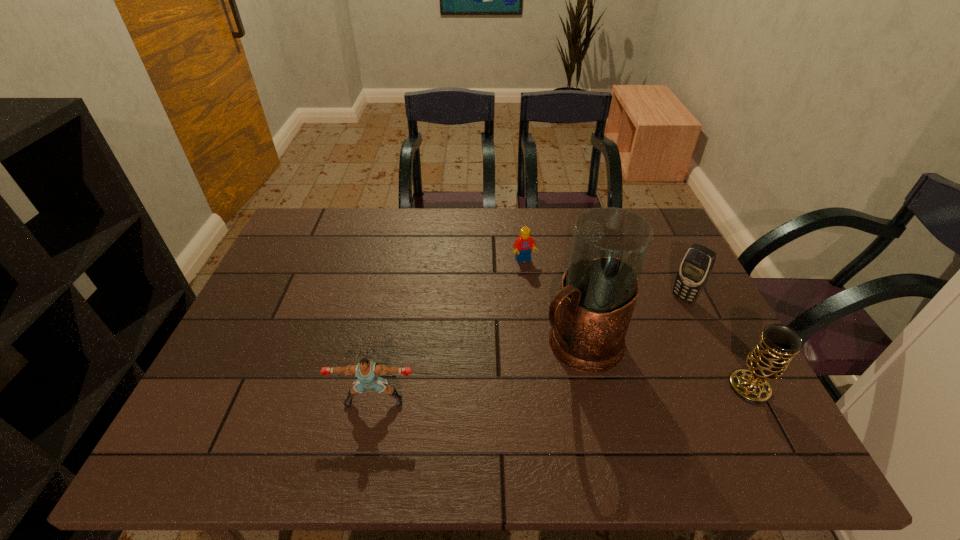
Identify the location of free space between the cellular telephone and the chalice. (716, 343).

The height and width of the screenshot is (540, 960). Find the location of `blank region between the pitcher and the cellular telephone`. blank region between the pitcher and the cellular telephone is located at coordinates (632, 321).

This screenshot has width=960, height=540. In order to click on vacant space that is in between the tallest object and the second shortest object in this screenshot , I will do `click(477, 373)`.

Identify the location of object identified as the second closest to the pitcher. The height and width of the screenshot is (540, 960). (523, 245).

Where is `object that is the fourth closest one to the chalice`? This screenshot has height=540, width=960. object that is the fourth closest one to the chalice is located at coordinates (366, 371).

You are a GUI agent. You are given a task and a screenshot of the screen. Output one action in this format:
    pyautogui.click(x=<x>, y=<y>)
    Task: Click on the free space in the image that satisfies the following two spatial constraints: 1. on the back side of the cellular telephone; 2. on the right side of the tallest object
    
    Given the screenshot: What is the action you would take?
    pyautogui.click(x=570, y=298)